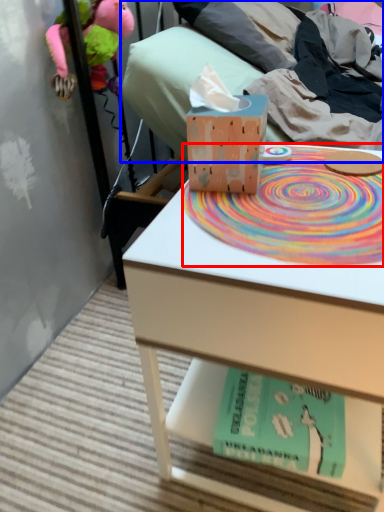
Question: Which object is further to the camera taking this photo, mat (highlighted by a red box) or bed (highlighted by a blue box)?

Choices:
 (A) mat
 (B) bed

Answer: (B)